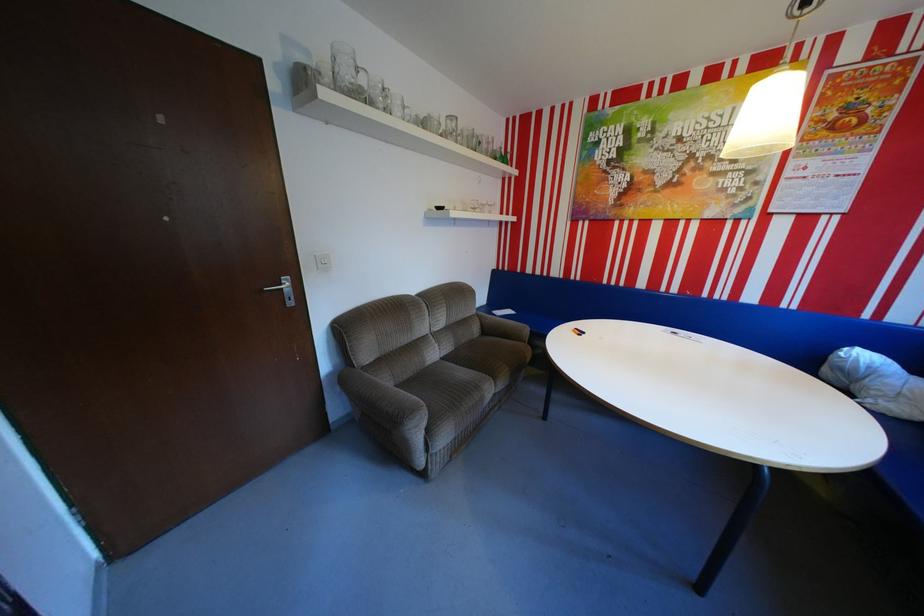
The location [347,71] corresponds to which object?

It refers to a small glass.